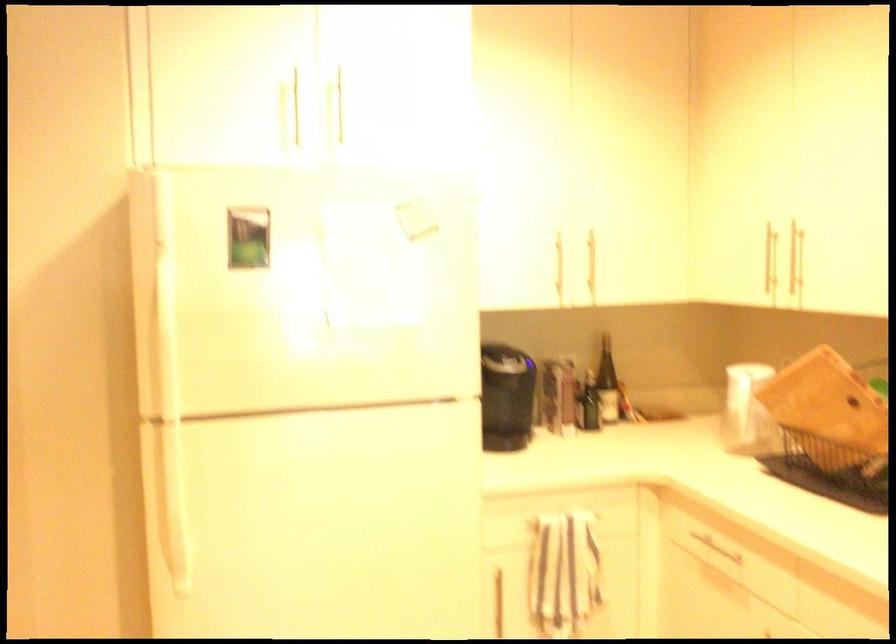
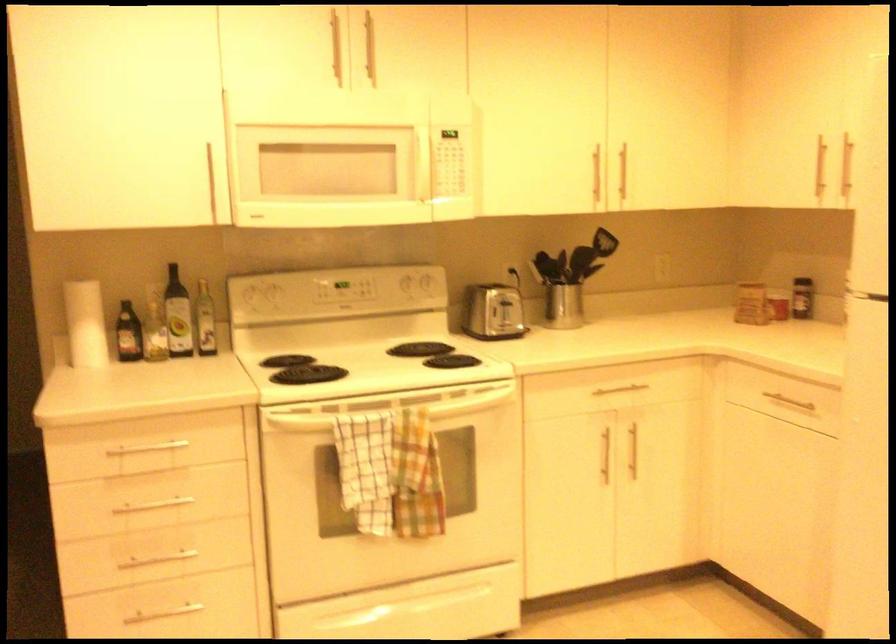
Question: The camera is either moving clockwise (left) or counter-clockwise (right) around the object. The first image is from the beginning of the video and the second image is from the end. Is the camera moving left or right when shooting the video?

Choices:
 (A) Left
 (B) Right

Answer: (B)